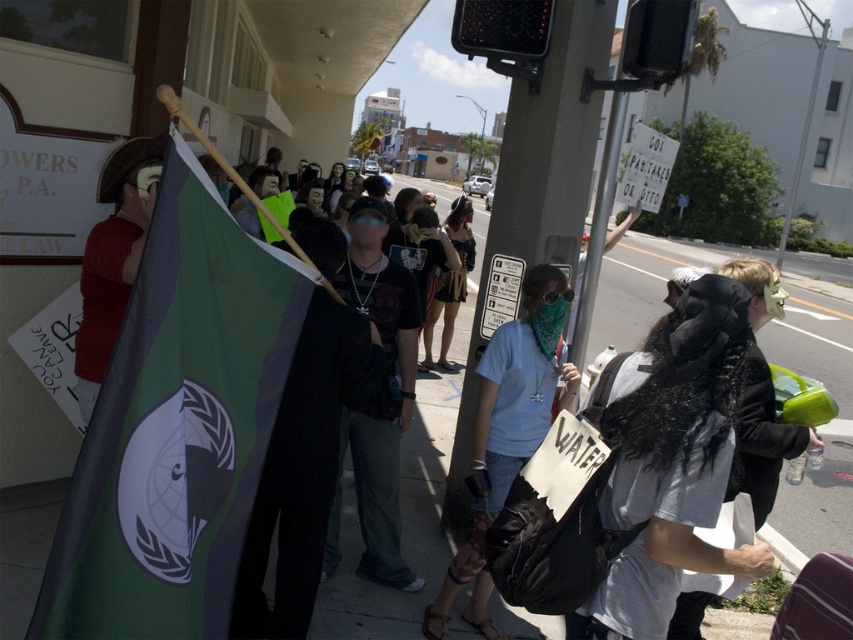
Question: Does white cotton t-shirt at center have a lesser width compared to fuzzy black coat at center?

Choices:
 (A) yes
 (B) no

Answer: (B)

Question: Which point is closer to the camera taking this photo?

Choices:
 (A) (390, 573)
 (B) (669, 408)
 (C) (102, 529)
 (D) (553, 275)

Answer: (C)

Question: Which object appears closest to the camera in this image?

Choices:
 (A) white cotton t-shirt at center
 (B) blue cotton shirt at center
 (C) fuzzy black coat at center
 (D) green fabric flag at left

Answer: (D)

Question: Is red fuzzy sweater at left positioned in front of fuzzy black coat at center?

Choices:
 (A) no
 (B) yes

Answer: (B)

Question: Which point is closer to the camera taking this photo?

Choices:
 (A) (671, 524)
 (B) (688, 609)

Answer: (A)

Question: Does red fuzzy sweater at left have a lesser width compared to fuzzy black coat at center?

Choices:
 (A) yes
 (B) no

Answer: (B)